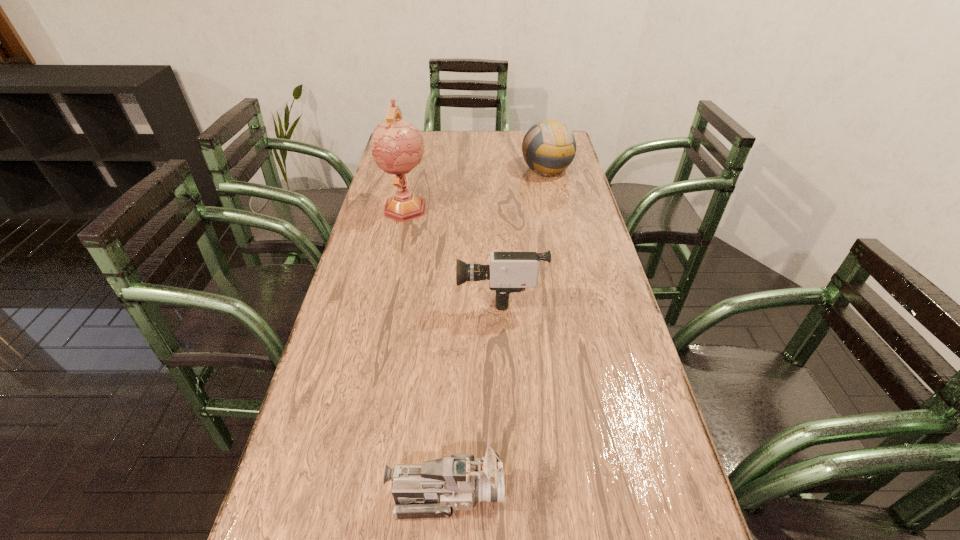
You are a GUI agent. You are given a task and a screenshot of the screen. Output one action in this format:
    pyautogui.click(x=<x>, y=<y>)
    Task: Click on the blank region between the volleyball and the shorter camcorder
    This screenshot has width=960, height=540.
    Given the screenshot: What is the action you would take?
    pyautogui.click(x=496, y=331)

You are a GUI agent. You are given a task and a screenshot of the screen. Output one action in this format:
    pyautogui.click(x=<x>, y=<y>)
    Task: Click on the vacant point located between the taller camcorder and the shortest object
    
    Given the screenshot: What is the action you would take?
    pyautogui.click(x=473, y=393)

The image size is (960, 540). What are the coordinates of `vacant area between the third farthest object and the nearest object` in the screenshot? It's located at (473, 393).

This screenshot has height=540, width=960. Find the location of `free space between the volleyball and the globe`. free space between the volleyball and the globe is located at coordinates (476, 188).

The width and height of the screenshot is (960, 540). I want to click on free space between the volleyball and the globe, so click(476, 188).

I want to click on free space that is in between the third nearest object and the second nearest object, so click(453, 250).

Find the location of a particular element. The height and width of the screenshot is (540, 960). vacant area that lies between the second nearest object and the nearest object is located at coordinates (473, 393).

The height and width of the screenshot is (540, 960). In order to click on vacant space that is in between the farther camcorder and the volleyball in this screenshot , I will do `click(523, 231)`.

Find the location of a particular element. vacant space in between the third nearest object and the shortest object is located at coordinates (426, 350).

At what (x,y) coordinates should I click in order to perform the action: click on free spot between the second farthest object and the taller camcorder. Please return your answer as a coordinate pair (x, y). Looking at the image, I should click on (453, 250).